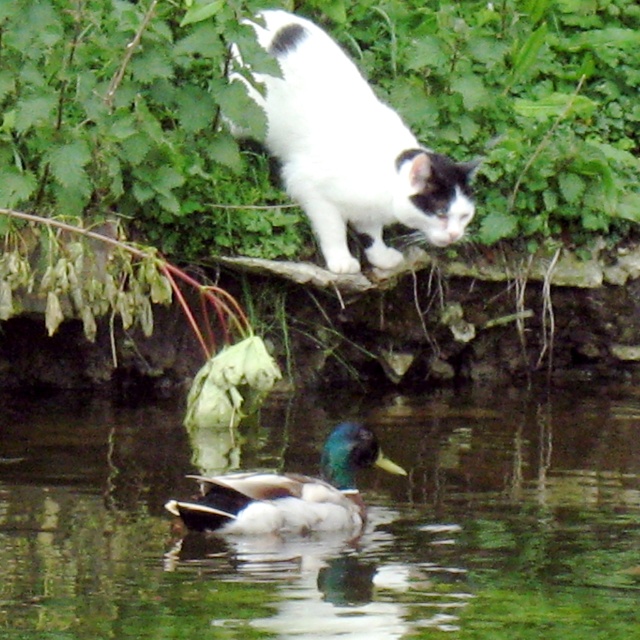
You are a photographer trying to capture the white fluffy duck at lower center in the center of your camera frame. Given the duck is at coordinates 0.841 on the x axis and 0.523 on the y axis, what direction should you move your camera to center the duck?

To center the white fluffy duck at lower center, you should move the camera to the left since the duck is located at x coordinate 0.841 which is to the right of the center point at x 0.5. The y coordinate 0.523 is slightly above the center y 0.5, so a slight upward adjustment may also be needed but the primary adjustment is left.

From the picture: You are the cat on the stone ledge observing the white fluffy duck at lower center. Based on your position, can you estimate the duck is closer to the water or the stone ledge?

The white fluffy duck at lower center is located at point (x=333, y=538), which is closer to the water than the stone ledge.

You are a photographer trying to capture the white fluffy duck at lower center and the white fur cat at upper center in the same frame. Based on their positions, which one is positioned to the left side of the other?

The white fluffy duck at lower center is to the left of the white fur cat at upper center.